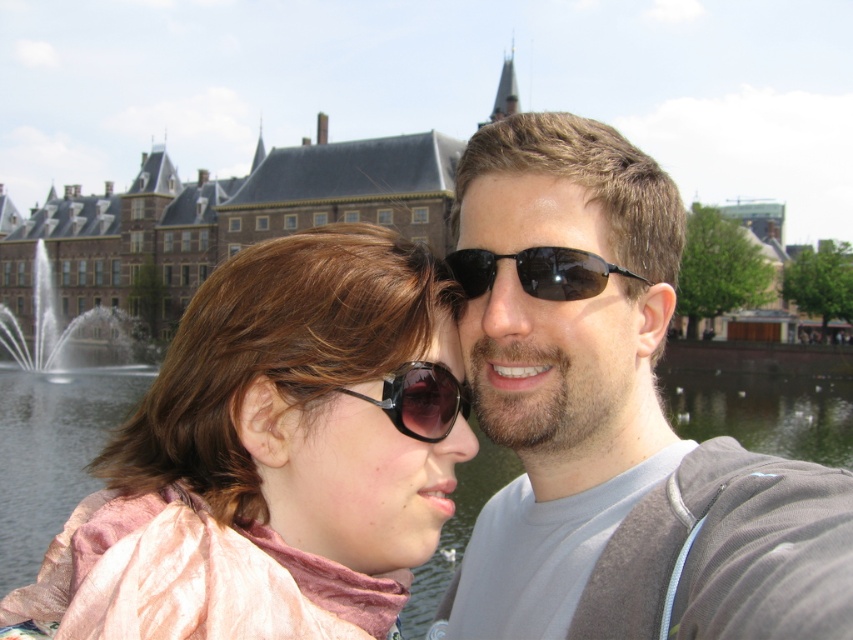
You are a photographer trying to capture a clear shot of both the pink fabric scarf at center and the sunglasses at center in the scene. Given that your camera has a maximum focus range of 3 meters, will you be able to focus on both objects simultaneously?

The pink fabric scarf at center and sunglasses at center are 3.45 meters apart from each other. Since the distance between them exceeds the camera maximum focus range of 3 meters, you cannot focus on both objects simultaneously.

You are a photographer planning to capture a similar scene. You want to ensure the transparent water at center and the silver metallic fountain at center are both visible in your shot. Given their positions, which object should you focus on first to capture both effectively?

The transparent water at center is positioned under the silver metallic fountain at center, so focusing on the silver metallic fountain at center first would allow both objects to be in frame since the water is directly beneath it.

You are a photographer adjusting the camera focus. You notice the pink fabric scarf at center and the sunglasses at center in the frame. Which object should you focus on first to ensure both are in focus?

The pink fabric scarf at center is in front of the sunglasses at center, so focusing on the sunglasses at center first will ensure both are in focus as the scarf is closer and the sunglasses are further back.